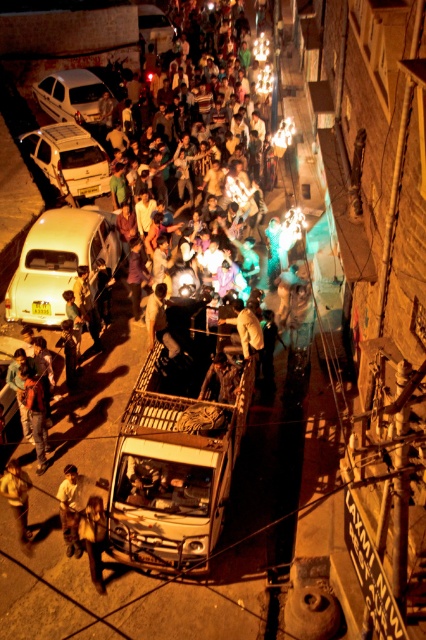
Who is shorter, dark brown leather shoes at lower center or metallic silver car at upper left?

With less height is dark brown leather shoes at lower center.

Does dark brown leather shoes at lower center have a larger size compared to metallic silver car at upper left?

Incorrect, dark brown leather shoes at lower center is not larger than metallic silver car at upper left.

Measure the distance between dark brown leather shoes at lower center and camera.

The distance of dark brown leather shoes at lower center from camera is 9.72 meters.

The height and width of the screenshot is (640, 426). I want to click on dark brown leather shoes at lower center, so click(x=94, y=538).

Does dark brown leather shoes at lower center lie behind dark brown leather jacket at center?

No, dark brown leather shoes at lower center is closer to the viewer.

Is point (100, 547) closer to viewer compared to point (209, 372)?

Yes, it is in front of point (209, 372).

The image size is (426, 640). I want to click on dark brown leather shoes at lower center, so click(x=94, y=538).

Looking at this image, between matte white sedan at upper left and metallic silver car at upper left, which one has more height?

metallic silver car at upper left is taller.

The height and width of the screenshot is (640, 426). Identify the location of matte white sedan at upper left. (71, 93).